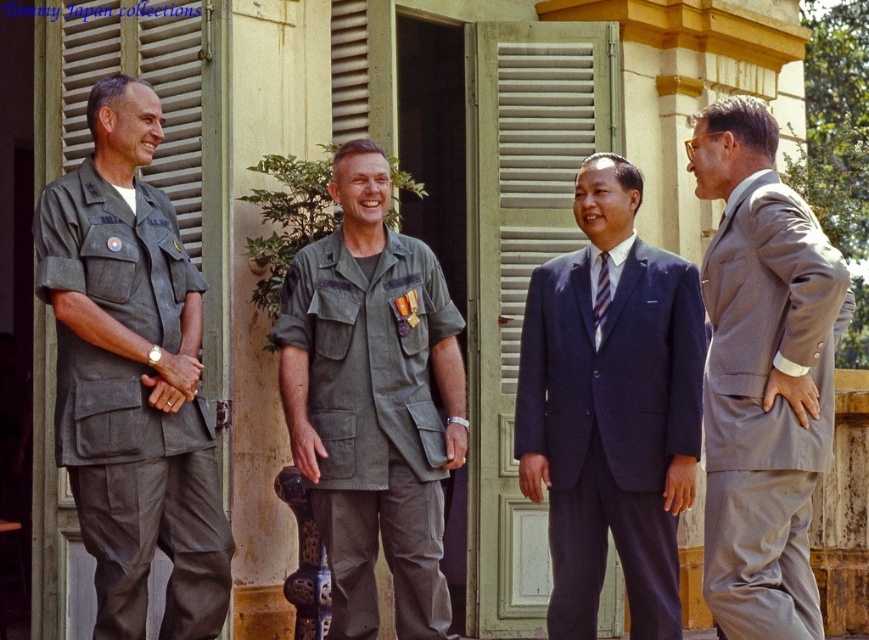
You are a photographer preparing to take a group photo of the matte green uniform at left and the gray wool suit at right. Considering their sizes, which individual should you position closer to the camera to ensure both appear balanced in the frame?

The matte green uniform at left is larger in size compared to the gray wool suit at right. To balance their appearance in the photo, you should position the gray wool suit at right closer to the camera than the matte green uniform at left.

You are a photographer at this event and need to capture a clear photo of both the matte green uniform at center and the striped silk tie at center. Since the camera can only focus on one object at a time, which object should you focus on to ensure the other is still in the background?

You should focus on the matte green uniform at center because it is closer to the viewer than the striped silk tie at center, so focusing on it will keep the striped silk tie at center in the background.

You are a photographer standing at the origin point in the scene. You need to capture a photo of the matte green uniform at center. What are the coordinates where you should aim your camera?

The coordinates to aim the camera are at point (372, 401).